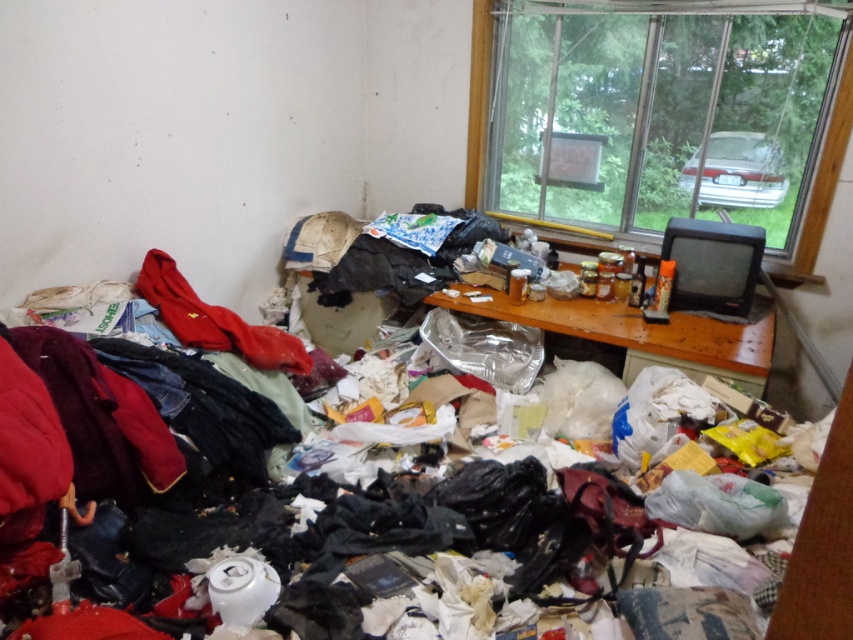
Question: Does shiny plastic bags at center have a smaller size compared to matte red sweatshirt at left?

Choices:
 (A) yes
 (B) no

Answer: (B)

Question: Can you confirm if shiny plastic bags at center is thinner than transparent glass window at upper right?

Choices:
 (A) no
 (B) yes

Answer: (A)

Question: Considering the real-world distances, which object is farthest from the shiny plastic bags at center?

Choices:
 (A) matte red sweatshirt at left
 (B) transparent glass window at upper right

Answer: (B)

Question: Among these points, which one is farthest from the camera?

Choices:
 (A) (476, 58)
 (B) (180, 412)

Answer: (A)

Question: Considering the relative positions of shiny plastic bags at center and matte red sweatshirt at left in the image provided, where is shiny plastic bags at center located with respect to matte red sweatshirt at left?

Choices:
 (A) right
 (B) left

Answer: (A)

Question: Considering the real-world distances, which object is closest to the matte red sweatshirt at left?

Choices:
 (A) shiny plastic bags at center
 (B) transparent glass window at upper right

Answer: (A)